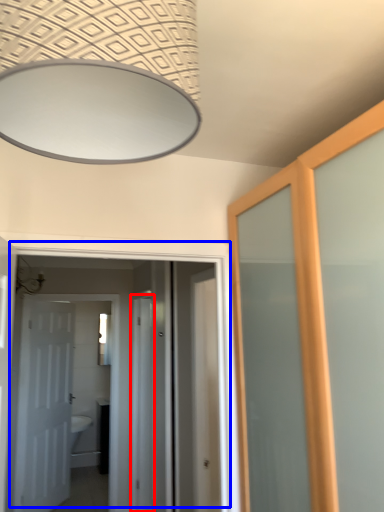
Question: Which object appears closest to the camera in this image, screen door (highlighted by a red box) or door (highlighted by a blue box)?

Choices:
 (A) screen door
 (B) door

Answer: (B)